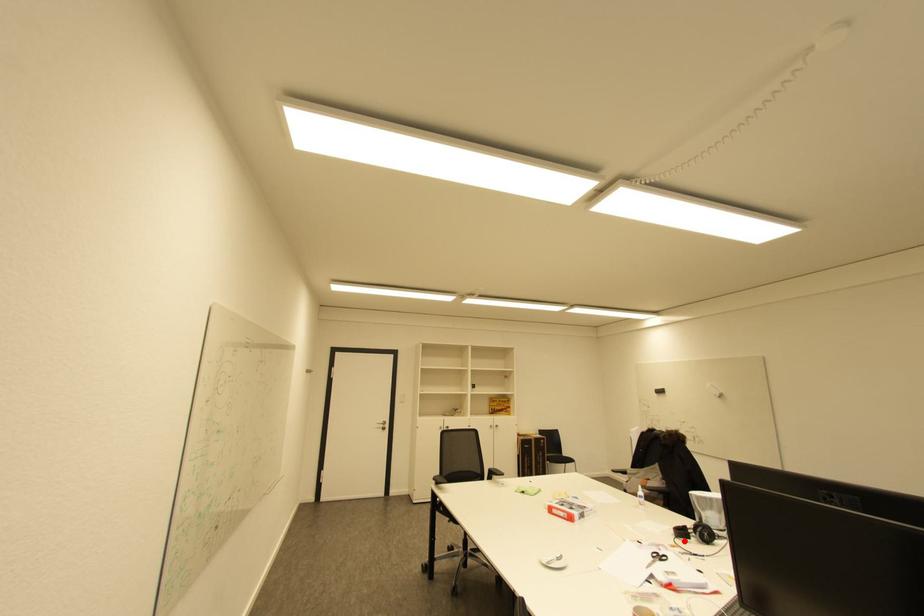
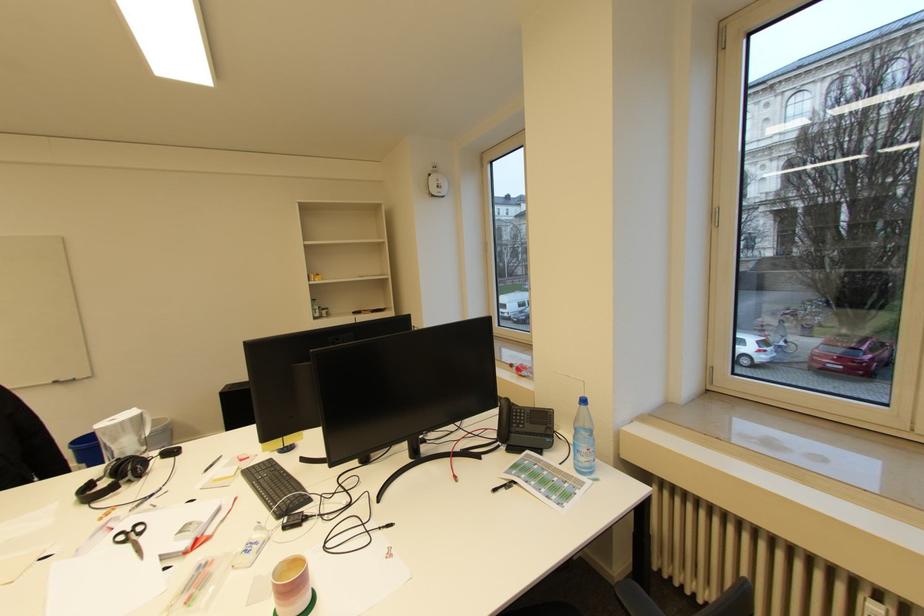
In the second image, find the point that corresponds to the highlighted location in the first image.

(100, 506)